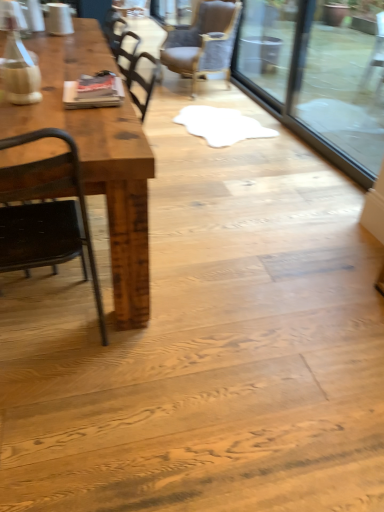
Question: Is point (124, 236) closer or farther from the camera than point (178, 65)?

Choices:
 (A) closer
 (B) farther

Answer: (A)

Question: Looking at their shapes, would you say rustic wood table at left is wider or thinner than brown leather chair at upper center, acting as the second chair starting from the front?

Choices:
 (A) wide
 (B) thin

Answer: (A)

Question: Estimate the real-world distances between objects in this image. Which object is farther from the rustic wood table at left?

Choices:
 (A) black metal chair at left, the first chair when ordered from front to back
 (B) transparent glass door at upper right
 (C) brown leather chair at upper center, placed as the second chair when sorted from bottom to top

Answer: (B)

Question: Estimate the real-world distances between objects in this image. Which object is farther from the rustic wood table at left?

Choices:
 (A) transparent glass door at upper right
 (B) black metal chair at left, the 1th chair viewed from the left
 (C) brown leather chair at upper center, which is the second chair from left to right

Answer: (A)